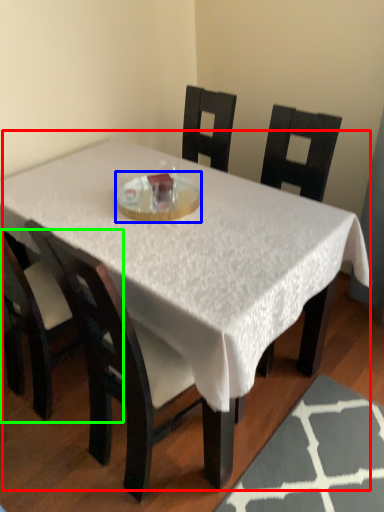
Question: Estimate the real-world distances between objects in this image. Which object is closer to table (highlighted by a red box), glass plate (highlighted by a blue box) or chair (highlighted by a green box)?

Choices:
 (A) glass plate
 (B) chair

Answer: (A)